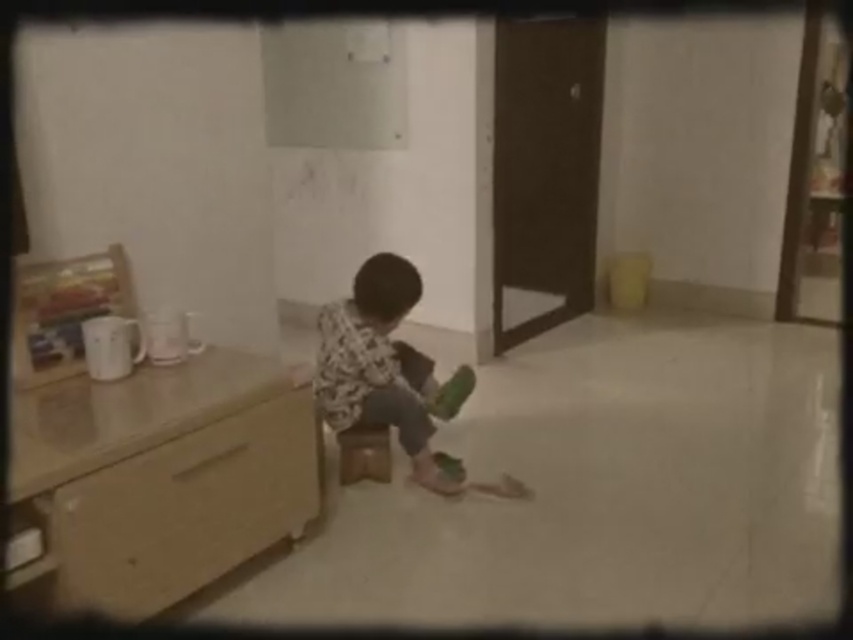
Is wooden drawer at lower left below brown wooden stool at center?

Indeed, wooden drawer at lower left is positioned under brown wooden stool at center.

Which of these two, wooden drawer at lower left or brown wooden stool at center, stands taller?

With more height is wooden drawer at lower left.

Between point (143, 609) and point (352, 448), which one is positioned behind?

Positioned behind is point (352, 448).

This screenshot has width=853, height=640. Find the location of `wooden drawer at lower left`. wooden drawer at lower left is located at coordinates (184, 509).

Between printed cotton shirt at center and brown wooden stool at center, which one is positioned lower?

Positioned lower is brown wooden stool at center.

Describe the element at coordinates (380, 365) in the screenshot. The width and height of the screenshot is (853, 640). I see `printed cotton shirt at center` at that location.

The height and width of the screenshot is (640, 853). What do you see at coordinates (380, 365) in the screenshot?
I see `printed cotton shirt at center` at bounding box center [380, 365].

Where is `printed cotton shirt at center`? printed cotton shirt at center is located at coordinates coord(380,365).

Between wooden drawer at lower left and printed cotton shirt at center, which one is positioned lower?

wooden drawer at lower left is below.

Which is in front, point (157, 506) or point (320, 348)?

Positioned in front is point (157, 506).

This screenshot has height=640, width=853. What are the coordinates of `wooden drawer at lower left` in the screenshot? It's located at (184, 509).